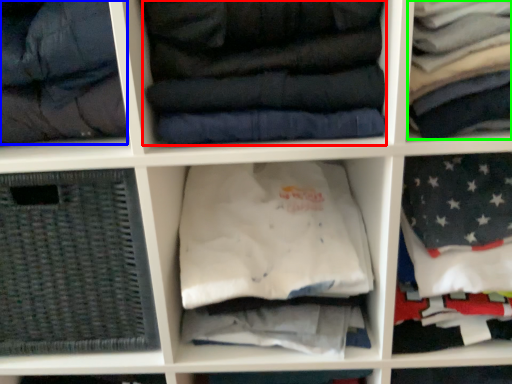
Question: Based on their relative distances, which object is nearer to clothing (highlighted by a red box)? Choose from garment (highlighted by a blue box) and clothing (highlighted by a green box).

Choices:
 (A) garment
 (B) clothing

Answer: (B)